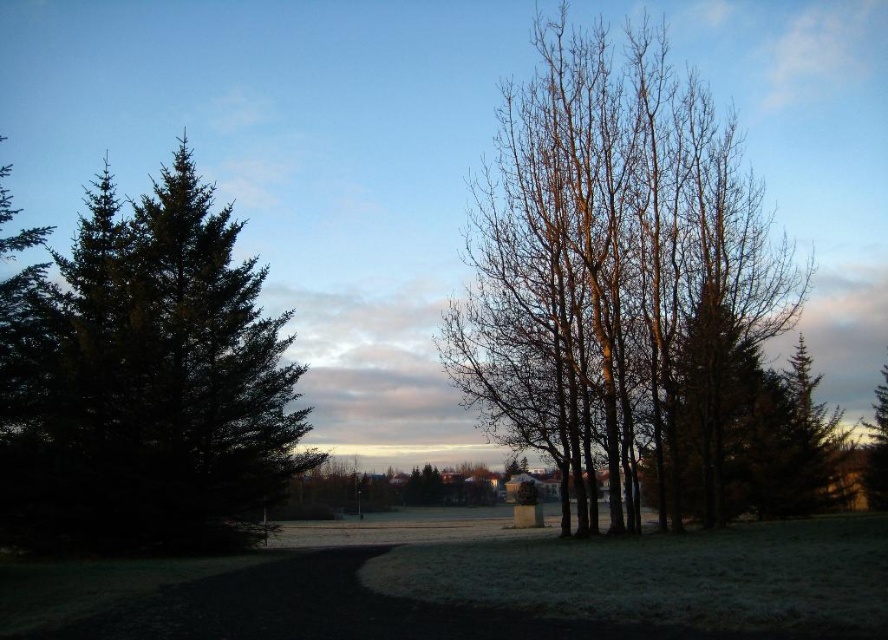
Measure the distance between bare branches at center and camera.

bare branches at center is 40.63 meters from camera.

Based on the photo, is bare branches at center thinner than green matte tree at left?

Incorrect, bare branches at center's width is not less than green matte tree at left's.

What do you see at coordinates (630, 292) in the screenshot?
I see `bare branches at center` at bounding box center [630, 292].

Where is `bare branches at center`? bare branches at center is located at coordinates (630, 292).